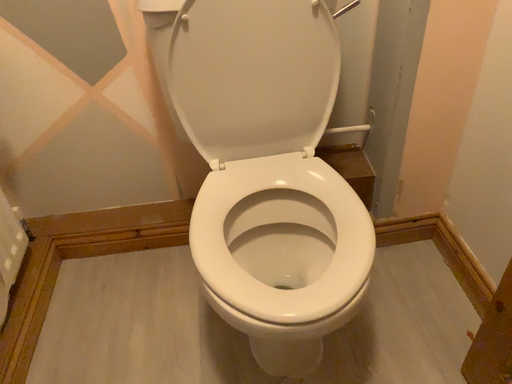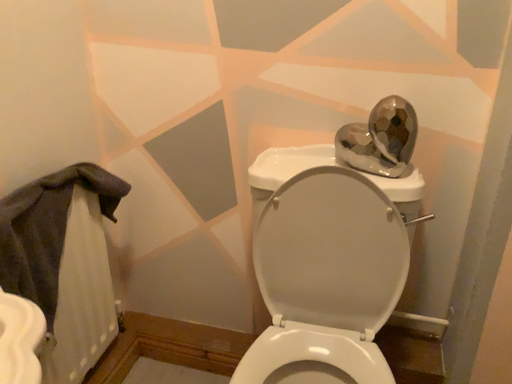
Question: How did the camera likely rotate when shooting the video?

Choices:
 (A) rotated right
 (B) rotated left

Answer: (B)